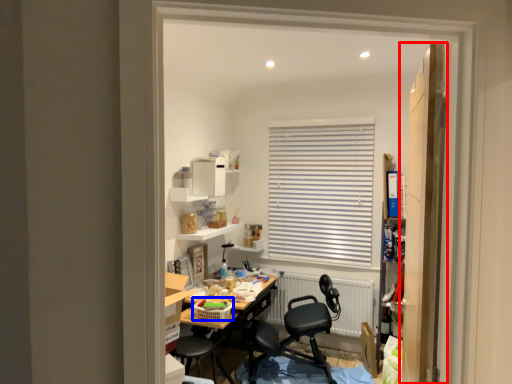
Question: Which object is further to the camera taking this photo, door (highlighted by a red box) or laundry basket (highlighted by a blue box)?

Choices:
 (A) door
 (B) laundry basket

Answer: (B)